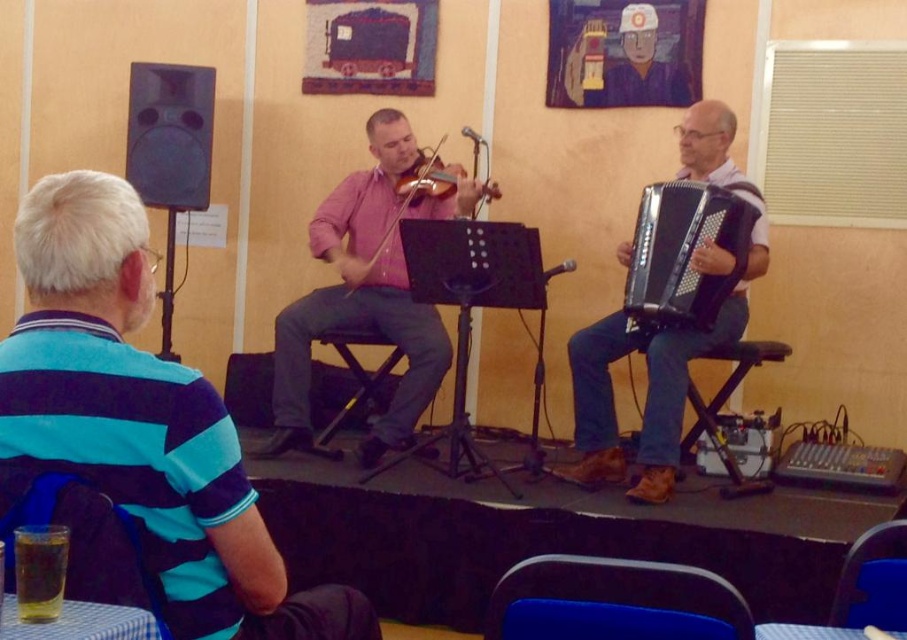
Can you confirm if black plastic accordion at right is taller than matte wood violin at center?

Correct, black plastic accordion at right is much taller as matte wood violin at center.

Does black plastic accordion at right have a greater width compared to matte wood violin at center?

Yes, black plastic accordion at right is wider than matte wood violin at center.

The width and height of the screenshot is (907, 640). Identify the location of black plastic accordion at right. (660, 337).

Can you confirm if blue striped shirt at left is smaller than matte wood violin at center?

Yes, blue striped shirt at left is smaller than matte wood violin at center.

At what (x,y) coordinates should I click in order to perform the action: click on blue striped shirt at left. Please return your answer as a coordinate pair (x, y). Looking at the image, I should click on (141, 422).

Which is more to the left, blue striped shirt at left or pink matte violinist at center?

blue striped shirt at left

Does blue striped shirt at left appear under pink matte violinist at center?

Indeed, blue striped shirt at left is positioned under pink matte violinist at center.

This screenshot has height=640, width=907. What are the coordinates of `blue striped shirt at left` in the screenshot? It's located at (141, 422).